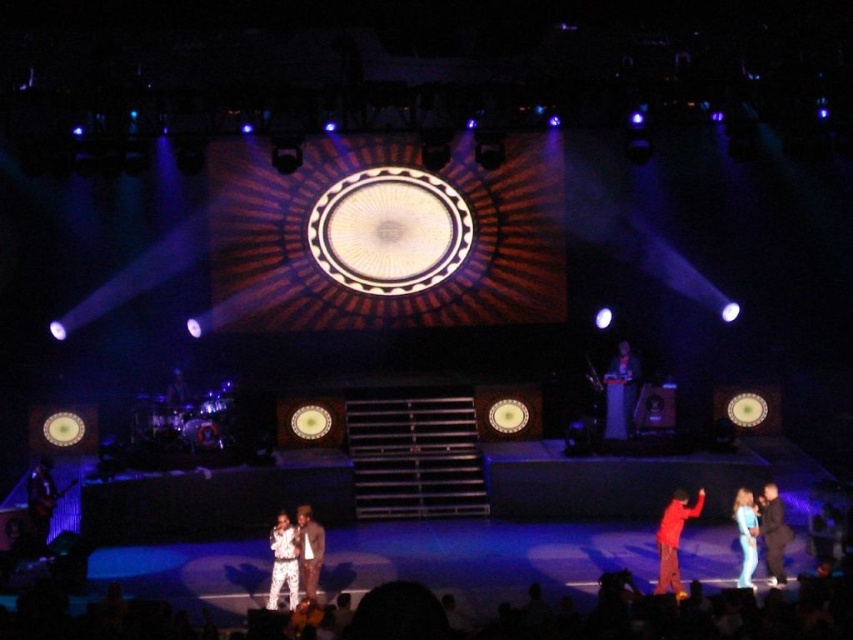
Question: Is matte red pants at lower right further to the viewer compared to white sequined outfit at center?

Choices:
 (A) no
 (B) yes

Answer: (B)

Question: Which point is closer to the camera?

Choices:
 (A) (315, 595)
 (B) (785, 538)
 (C) (747, 504)

Answer: (A)

Question: Is white sequined outfit at center positioned in front of light blue denim jeans at lower right?

Choices:
 (A) no
 (B) yes

Answer: (B)

Question: Estimate the real-world distances between objects in this image. Which object is closer to the white sequined outfit at center?

Choices:
 (A) light blue denim jeans at lower right
 (B) matte red pants at lower right
 (C) shiny brown suit at center

Answer: (C)

Question: Which point appears farthest from the camera in this image?

Choices:
 (A) (776, 490)
 (B) (294, 595)
 (C) (318, 532)

Answer: (A)

Question: In this image, where is matte red pants at lower right located relative to light blue denim jeans at lower right?

Choices:
 (A) above
 (B) below

Answer: (B)